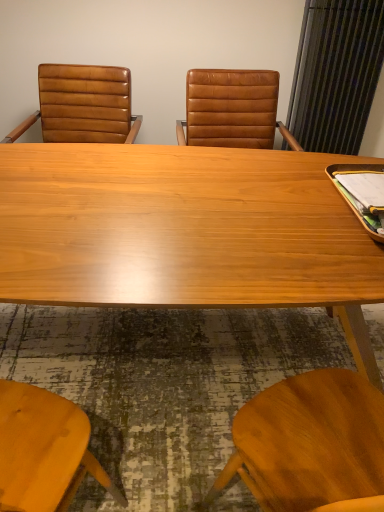
Question: Is the surface of wooden desk at center in direct contact with matte brown leather chair at left?

Choices:
 (A) yes
 (B) no

Answer: (B)

Question: Is wooden desk at center smaller than matte brown leather chair at left?

Choices:
 (A) no
 (B) yes

Answer: (A)

Question: Is wooden desk at center positioned behind matte brown leather chair at left?

Choices:
 (A) yes
 (B) no

Answer: (B)

Question: Does wooden desk at center have a larger size compared to matte brown leather chair at left?

Choices:
 (A) yes
 (B) no

Answer: (A)

Question: From the image's perspective, is wooden desk at center located beneath matte brown leather chair at left?

Choices:
 (A) yes
 (B) no

Answer: (A)

Question: From a real-world perspective, is wooden desk at center beneath matte brown leather chair at left?

Choices:
 (A) yes
 (B) no

Answer: (A)

Question: From the image's perspective, is matte brown leather chair at left under wooden desk at center?

Choices:
 (A) yes
 (B) no

Answer: (B)

Question: Does matte brown leather chair at left have a greater height compared to wooden desk at center?

Choices:
 (A) no
 (B) yes

Answer: (A)

Question: Can you confirm if matte brown leather chair at left is bigger than wooden desk at center?

Choices:
 (A) yes
 (B) no

Answer: (B)

Question: From a real-world perspective, is matte brown leather chair at left below wooden desk at center?

Choices:
 (A) no
 (B) yes

Answer: (A)

Question: Does matte brown leather chair at left have a greater width compared to wooden desk at center?

Choices:
 (A) yes
 (B) no

Answer: (B)

Question: Is matte brown leather chair at left next to wooden desk at center and touching it?

Choices:
 (A) yes
 (B) no

Answer: (B)

Question: Based on their sizes in the image, would you say wooden desk at center is bigger or smaller than matte brown leather chair at left?

Choices:
 (A) small
 (B) big

Answer: (B)